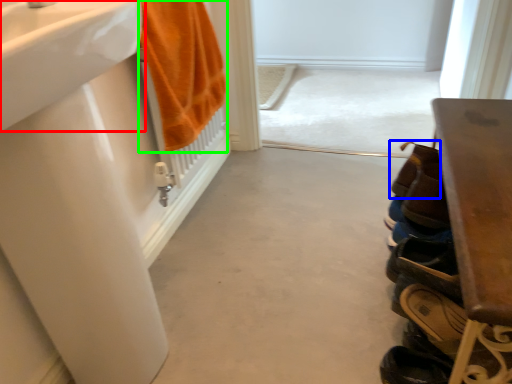
Question: Which is farther away from sink (highlighted by a red box)? shoe (highlighted by a blue box) or bath towel (highlighted by a green box)?

Choices:
 (A) shoe
 (B) bath towel

Answer: (A)